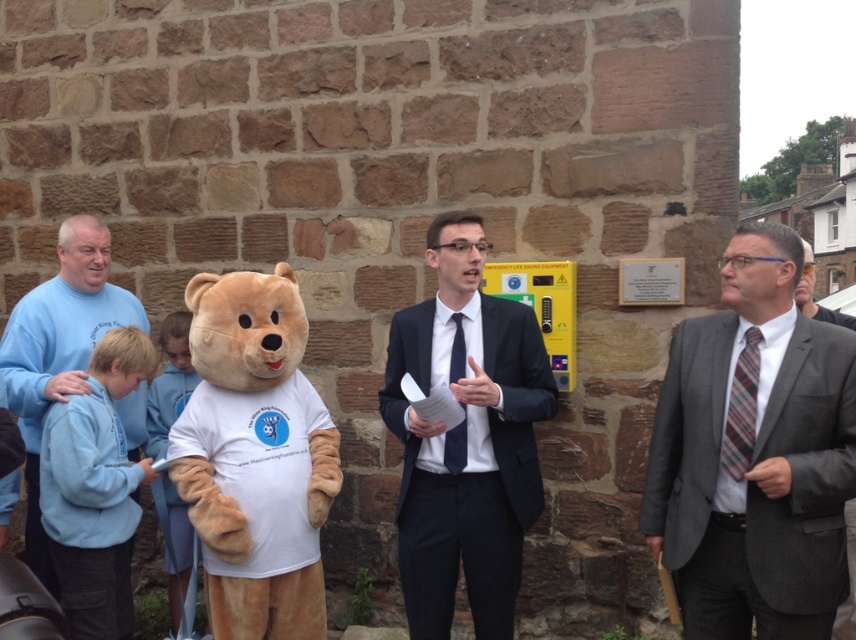
You are organizing a charity event and need to place a 50 cm wide banner between the dark blue suit at center and the fluffy beige teddy bear at center. Is there enough space?

The dark blue suit at center and fluffy beige teddy bear at center are 63.10 centimeters apart. Since the banner is 50 cm wide, there is enough space to place it between them.

In the scene shown: You are organizing a charity event and need to place the fluffy beige teddy bear at center and the plaid fabric tie at right on a shelf. If the shelf has a width of 1 meter, can both items fit side by side?

The fluffy beige teddy bear at center might be wider than plaid fabric tie at right, so it is uncertain if both can fit on a 1 meter shelf without overlapping. Measure their combined width first.

You are standing in the scene and want to place a new red flag exactly at the center of the image. Is the point marked by point (254, 456) already occupied by an object?

Yes, the point (254, 456) is occupied by the fluffy beige teddy bear at center, so placing the red flag there would overlap with it.